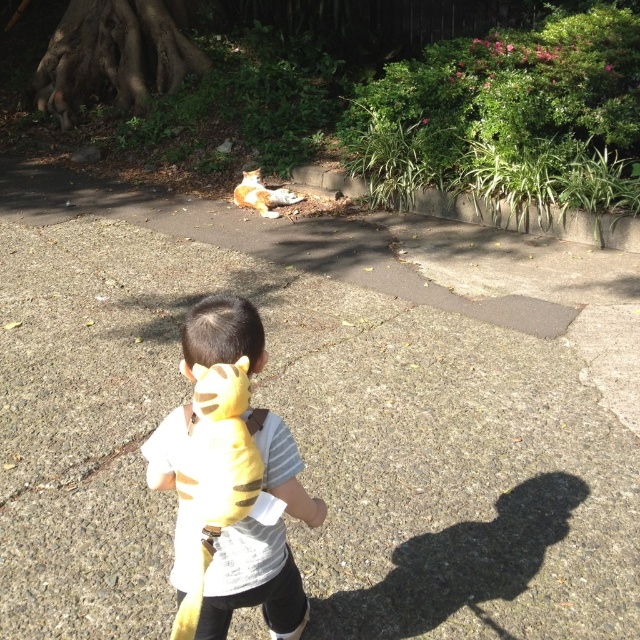
You are a photographer trying to capture both the yellow plush toy at center and the orange fur cat at center in the same frame. Based on their positions, which object is closer to the camera?

The yellow plush toy at center is closer to the camera because it is in front of the orange fur cat at center.